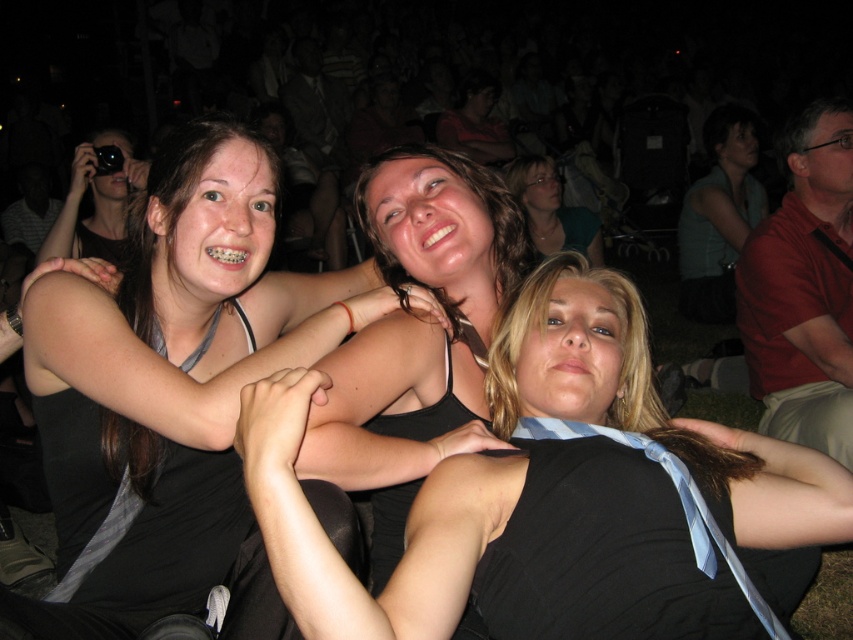
You are organizing a fashion show and need to arrange two dresses on a runway. The black silk dress at center and the black matte dress at left are both available. Which dress should you choose if you want the wider one for the runway?

The black silk dress at center is wider than the black matte dress at left, so you should choose the black silk dress at center for the runway.

You are standing at the front of the stage and notice two people in dresses. One is wearing a black silk dress at center and the other a black matte dress at left. Which dress is nearer to you?

The black silk dress at center is closer to the viewer than the black matte dress at left, so the black silk dress at center is nearer to you.